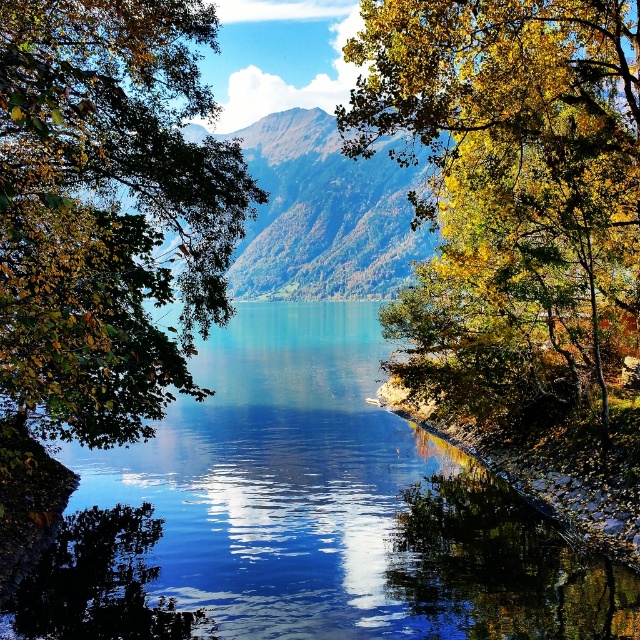
Question: Is the position of transparent water at center less distant than that of green grassy mountain at center?

Choices:
 (A) no
 (B) yes

Answer: (B)

Question: Which of the following is the closest to the observer?

Choices:
 (A) yellow-green leafy tree at upper right
 (B) transparent water at center
 (C) green grassy mountain at center

Answer: (B)

Question: Considering the relative positions of transparent water at center and green grassy mountain at center in the image provided, where is transparent water at center located with respect to green grassy mountain at center?

Choices:
 (A) below
 (B) above

Answer: (A)

Question: Which object is the farthest from the transparent water at center?

Choices:
 (A) green grassy mountain at center
 (B) yellow-green leafy tree at upper right

Answer: (B)

Question: Which object appears closest to the camera in this image?

Choices:
 (A) green leafy tree at left
 (B) green grassy mountain at center

Answer: (A)

Question: Does yellow-green leafy tree at upper right lie in front of green grassy mountain at center?

Choices:
 (A) yes
 (B) no

Answer: (A)